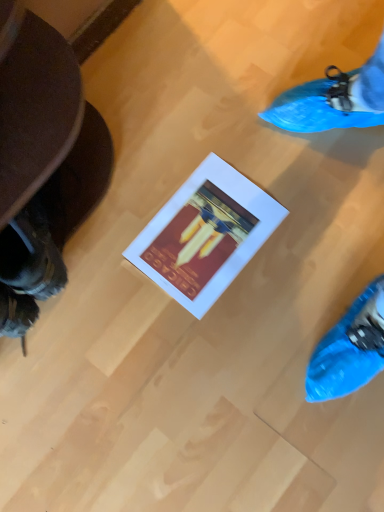
Locate an element on the screen. The width and height of the screenshot is (384, 512). free space to the right of white matte picture frame at center is located at coordinates (313, 210).